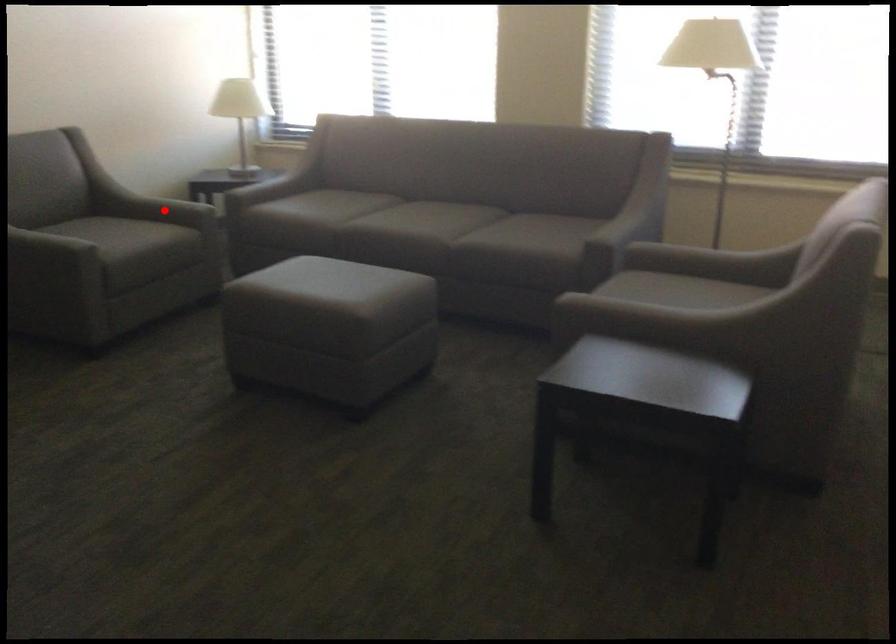
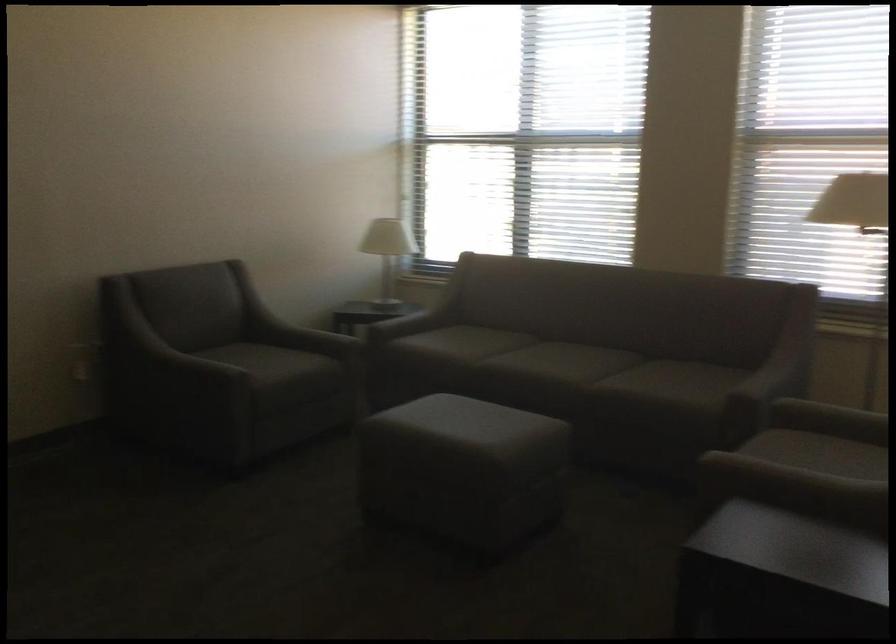
Locate, in the second image, the point that corresponds to the highlighted location in the first image.

(307, 339)